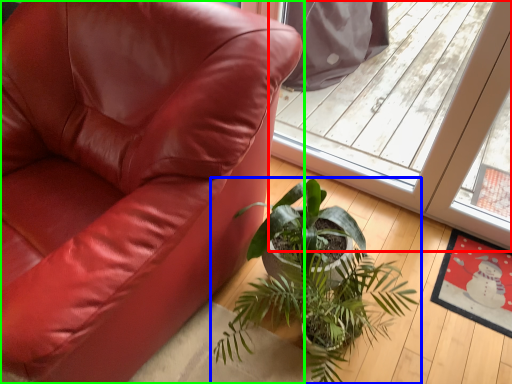
Question: Which object is the farthest from screen door (highlighted by a red box)? Choose among these: houseplant (highlighted by a blue box) or chair (highlighted by a green box).

Choices:
 (A) houseplant
 (B) chair

Answer: (B)